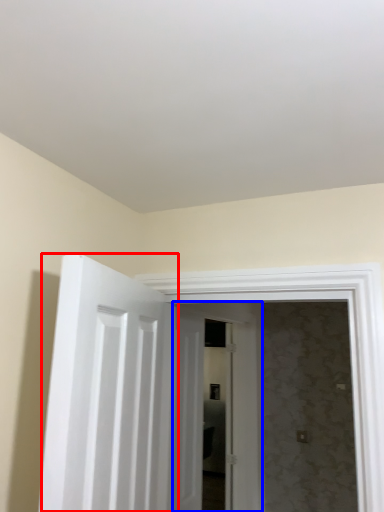
Question: Which of the following is the closest to the observer, door (highlighted by a red box) or door (highlighted by a blue box)?

Choices:
 (A) door
 (B) door

Answer: (A)